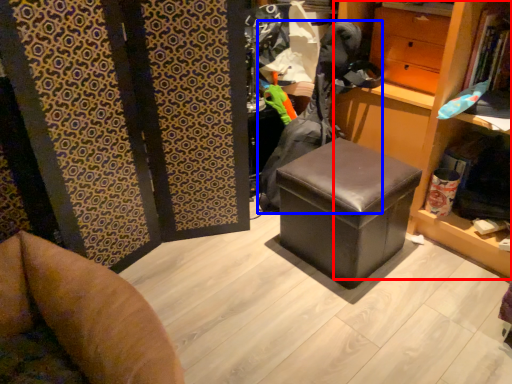
Question: Among these objects, which one is farthest to the camera, bookshelf (highlighted by a red box) or clothing (highlighted by a blue box)?

Choices:
 (A) bookshelf
 (B) clothing

Answer: (B)